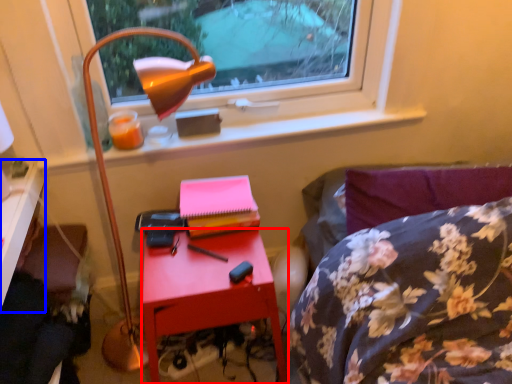
Question: Which object appears farthest to the camera in this image, nightstand (highlighted by a red box) or desk (highlighted by a blue box)?

Choices:
 (A) nightstand
 (B) desk

Answer: (A)